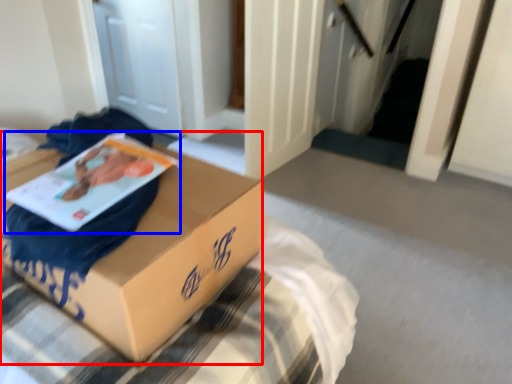
Question: Which of the following is the farthest to the observer, box (highlighted by a red box) or paperback book (highlighted by a blue box)?

Choices:
 (A) box
 (B) paperback book

Answer: (B)